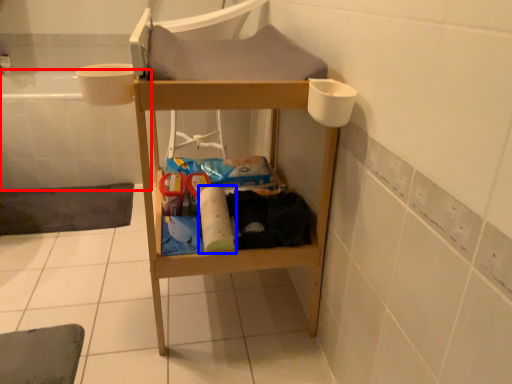
Question: Among these objects, which one is nearest to the camera, bath (highlighted by a red box) or toilet paper (highlighted by a blue box)?

Choices:
 (A) bath
 (B) toilet paper

Answer: (B)